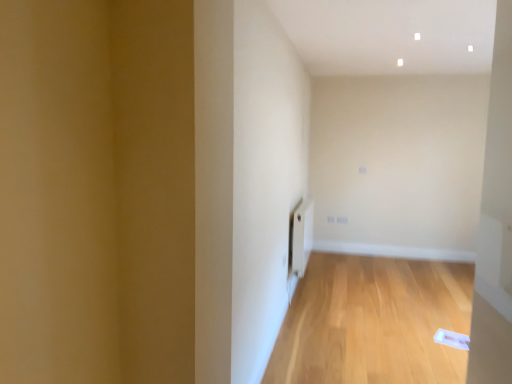
Identify the location of space that is in front of white matte radiator at center. The width and height of the screenshot is (512, 384). (335, 311).